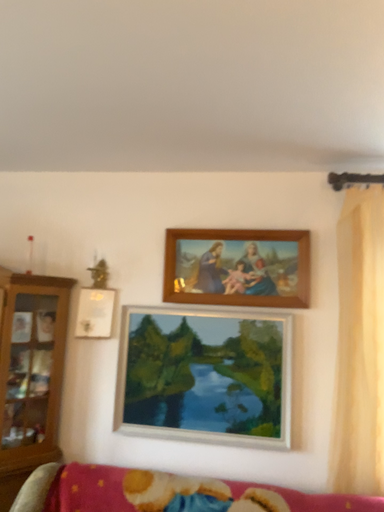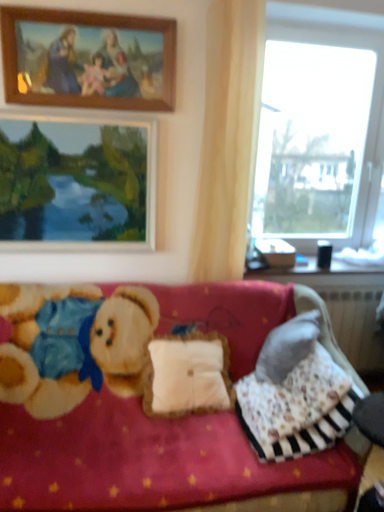
Question: How did the camera likely rotate when shooting the video?

Choices:
 (A) rotated upward
 (B) rotated downward

Answer: (B)